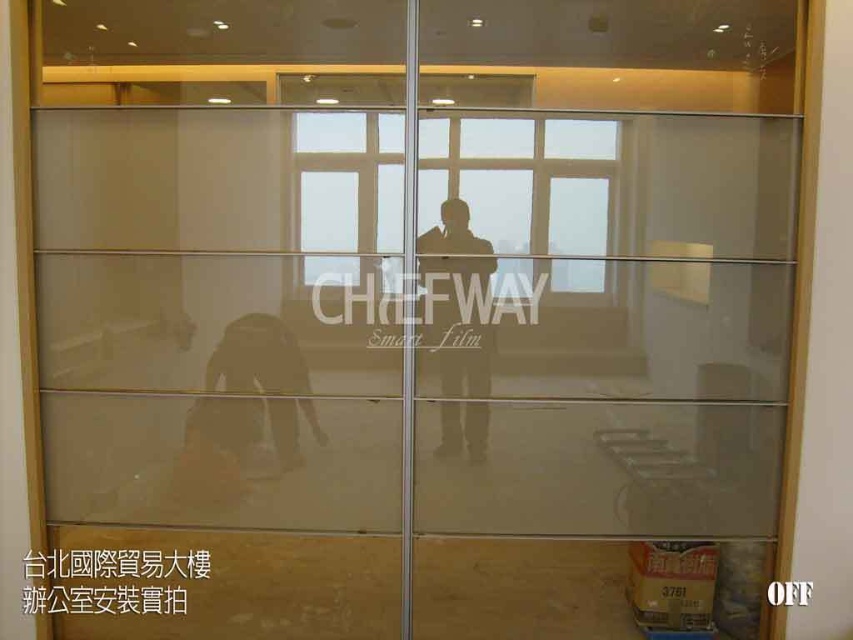
Question: Is transparent glass window at center to the left of translucent glass person at center from the viewer's perspective?

Choices:
 (A) no
 (B) yes

Answer: (B)

Question: Can you confirm if transparent glass window at center is positioned above translucent glass person at center?

Choices:
 (A) no
 (B) yes

Answer: (B)

Question: Which of the following is the closest to the observer?

Choices:
 (A) transparent glass window at center
 (B) translucent glass person at center

Answer: (A)

Question: Can you confirm if transparent glass window at center is positioned below translucent glass person at center?

Choices:
 (A) yes
 (B) no

Answer: (B)

Question: Which of the following is the closest to the observer?

Choices:
 (A) (560, 140)
 (B) (469, 230)

Answer: (A)